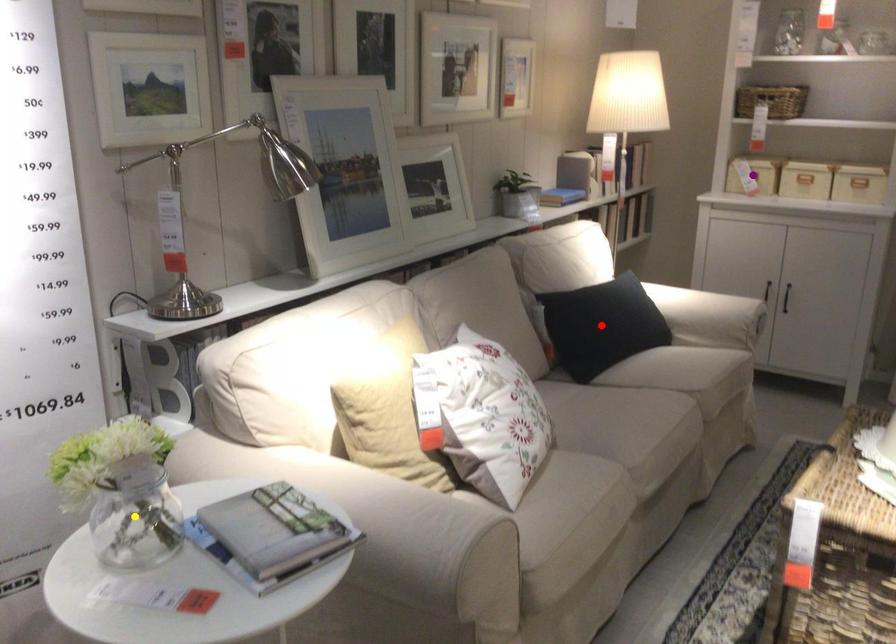
Order these from farthest to nearest:
A) yellow point
B) purple point
C) red point

purple point → red point → yellow point